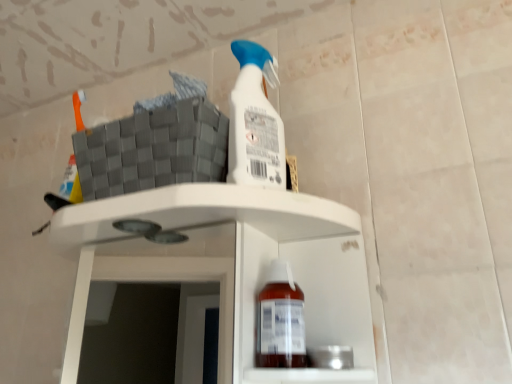
Question: Is translucent plastic bottle at lower center not inside white matte shelf at center?

Choices:
 (A) yes
 (B) no

Answer: (B)

Question: Can you confirm if translucent plastic bottle at lower center is shorter than white matte shelf at center?

Choices:
 (A) no
 (B) yes

Answer: (B)

Question: Is translucent plastic bottle at lower center smaller than white matte shelf at center?

Choices:
 (A) yes
 (B) no

Answer: (A)

Question: From the image's perspective, is translucent plastic bottle at lower center above white matte shelf at center?

Choices:
 (A) no
 (B) yes

Answer: (B)

Question: Is translucent plastic bottle at lower center far from white matte shelf at center?

Choices:
 (A) yes
 (B) no

Answer: (A)

Question: From a real-world perspective, is translucent plastic bottle at lower center under white matte shelf at center?

Choices:
 (A) no
 (B) yes

Answer: (B)

Question: Is white matte shelf at center closer to camera compared to translucent plastic bottle at lower center?

Choices:
 (A) no
 (B) yes

Answer: (B)

Question: From the image's perspective, is white matte shelf at center on top of translucent plastic bottle at lower center?

Choices:
 (A) no
 (B) yes

Answer: (A)

Question: Can you confirm if white matte shelf at center is shorter than translucent plastic bottle at lower center?

Choices:
 (A) yes
 (B) no

Answer: (B)

Question: Can you confirm if white matte shelf at center is thinner than translucent plastic bottle at lower center?

Choices:
 (A) no
 (B) yes

Answer: (A)

Question: From a real-world perspective, is white matte shelf at center positioned under translucent plastic bottle at lower center based on gravity?

Choices:
 (A) yes
 (B) no

Answer: (B)

Question: Is white matte shelf at center turned away from translucent plastic bottle at lower center?

Choices:
 (A) no
 (B) yes

Answer: (B)

Question: From the image's perspective, is translucent plastic bottle at lower center located above or below white matte shelf at center?

Choices:
 (A) above
 (B) below

Answer: (A)